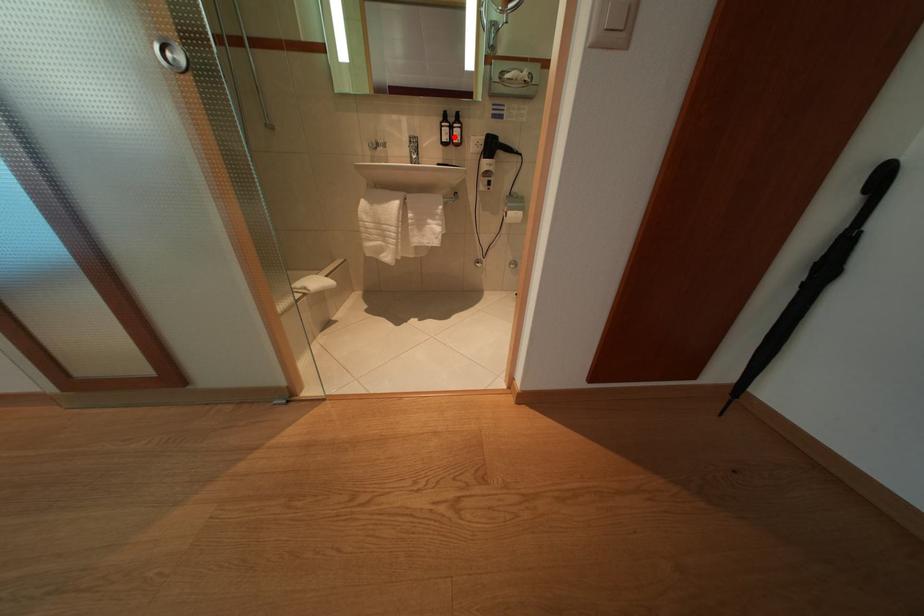
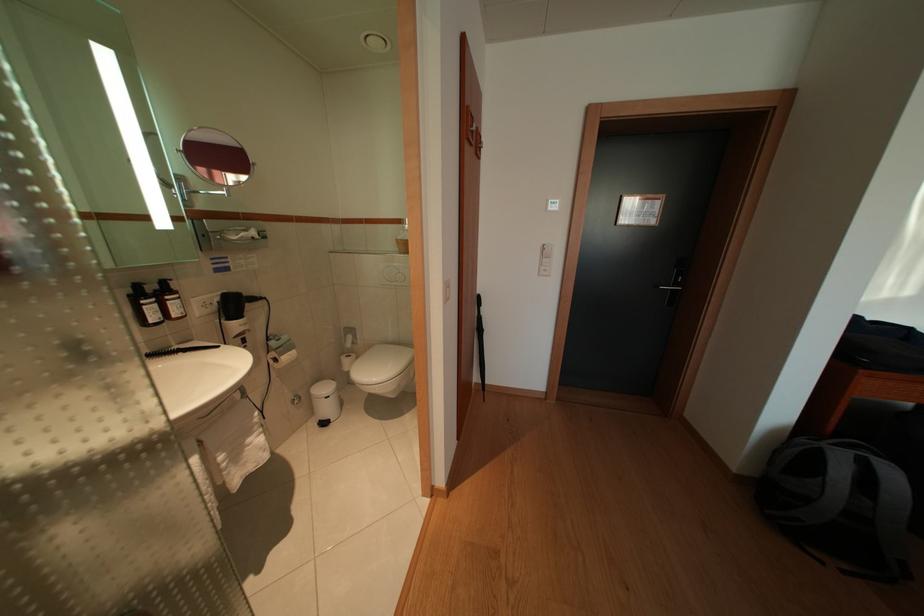
Where in the second image is the point corresponding to the highlighted location from the first image?

(159, 315)